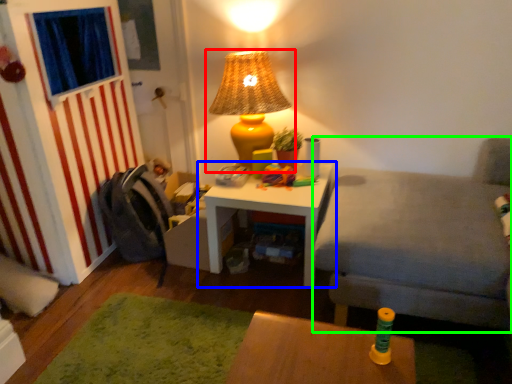
Question: Based on their relative distances, which object is nearer to lamp (highlighted by a red box)? Choose from table (highlighted by a blue box) and couch (highlighted by a green box).

Choices:
 (A) table
 (B) couch

Answer: (A)